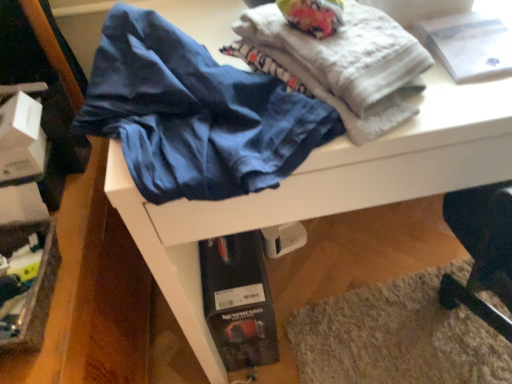
Question: Is the depth of white textured towel at upper center greater than that of matte blue underwear at center?

Choices:
 (A) yes
 (B) no

Answer: (A)

Question: Is there a large distance between white textured towel at upper center and matte blue underwear at center?

Choices:
 (A) no
 (B) yes

Answer: (A)

Question: Is white textured towel at upper center beside matte blue underwear at center?

Choices:
 (A) no
 (B) yes

Answer: (A)

Question: Is white textured towel at upper center facing towards matte blue underwear at center?

Choices:
 (A) no
 (B) yes

Answer: (A)

Question: Is white textured towel at upper center wider than matte blue underwear at center?

Choices:
 (A) no
 (B) yes

Answer: (A)

Question: Does point (202, 52) appear closer or farther from the camera than point (460, 36)?

Choices:
 (A) closer
 (B) farther

Answer: (A)

Question: In the image, is matte blue underwear at center positioned in front of or behind white paper at upper right?

Choices:
 (A) front
 (B) behind

Answer: (A)

Question: Is matte blue underwear at center bigger or smaller than white paper at upper right?

Choices:
 (A) small
 (B) big

Answer: (B)

Question: Would you say matte blue underwear at center is inside or outside white paper at upper right?

Choices:
 (A) inside
 (B) outside

Answer: (B)

Question: Considering their positions, is white paper at upper right located in front of or behind matte blue underwear at center?

Choices:
 (A) behind
 (B) front

Answer: (A)

Question: Is white paper at upper right wider or thinner than matte blue underwear at center?

Choices:
 (A) thin
 (B) wide

Answer: (A)

Question: In terms of height, does white paper at upper right look taller or shorter compared to matte blue underwear at center?

Choices:
 (A) short
 (B) tall

Answer: (A)

Question: Is white paper at upper right situated inside matte blue underwear at center or outside?

Choices:
 (A) inside
 (B) outside

Answer: (B)

Question: Is point click(x=245, y=112) closer or farther from the camera than point click(x=379, y=124)?

Choices:
 (A) farther
 (B) closer

Answer: (A)

Question: Is matte blue underwear at center taller or shorter than white textured towel at upper center?

Choices:
 (A) tall
 (B) short

Answer: (A)